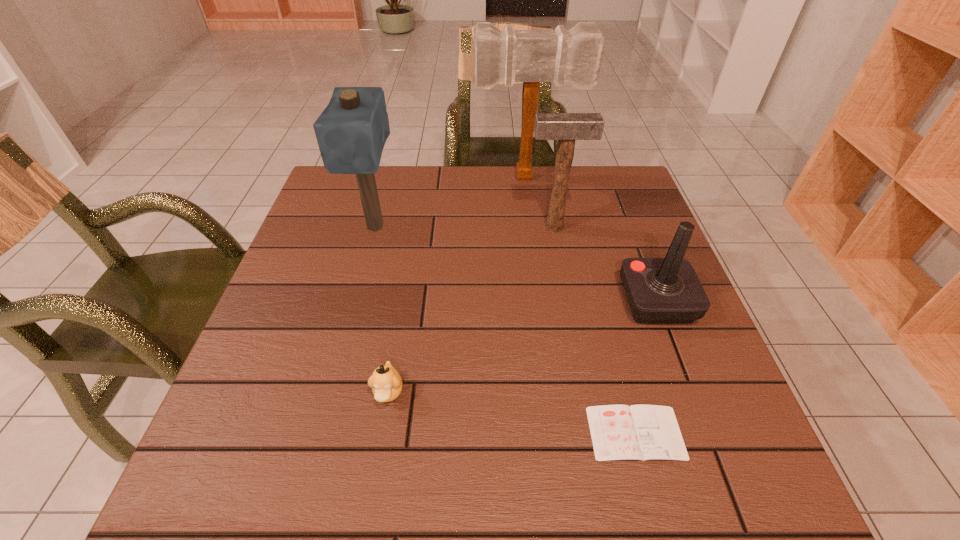
Identify the location of the farthest object. (530, 56).

Find the location of a particular element. This screenshot has height=540, width=960. the second tallest mallet is located at coordinates (351, 132).

You are a GUI agent. You are given a task and a screenshot of the screen. Output one action in this format:
    pyautogui.click(x=<x>, y=<y>)
    Task: Click on the second tallest object
    This screenshot has height=540, width=960.
    Given the screenshot: What is the action you would take?
    pyautogui.click(x=351, y=132)

You are a GUI agent. You are given a task and a screenshot of the screen. Output one action in this format:
    pyautogui.click(x=<x>, y=<y>)
    Task: Click on the third tallest object
    
    Given the screenshot: What is the action you would take?
    [565, 127]

In order to click on the third nearest object in this screenshot , I will do `click(667, 290)`.

Locate an element on the screen. This screenshot has height=540, width=960. the third shortest object is located at coordinates (667, 290).

Where is `the second shortest object`? The height and width of the screenshot is (540, 960). the second shortest object is located at coordinates (386, 383).

At what (x,y) coordinates should I click in order to perform the action: click on duckling. Please return your answer as a coordinate pair (x, y). This screenshot has height=540, width=960. Looking at the image, I should click on (386, 383).

Where is `diary`? diary is located at coordinates (619, 432).

Find the location of a particular element. This screenshot has width=960, height=540. blank space located 0.100m on the left of the farthest mallet is located at coordinates (442, 177).